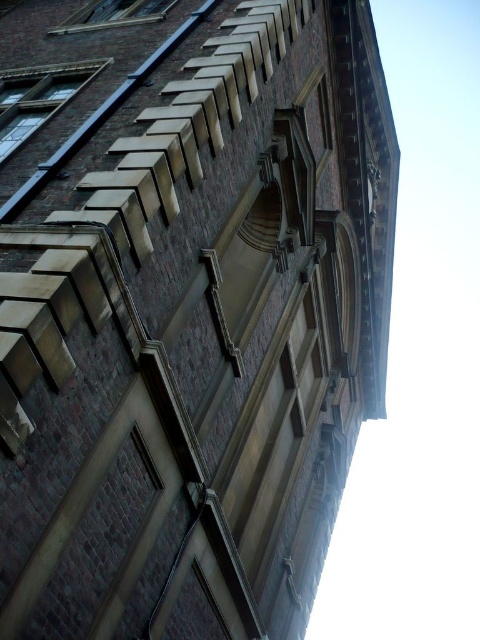
Question: Which point appears closest to the camera in this image?

Choices:
 (A) (x=13, y=83)
 (B) (x=115, y=20)

Answer: (A)

Question: Which point appears farthest from the camera in this image?

Choices:
 (A) click(x=59, y=65)
 (B) click(x=68, y=22)

Answer: (B)

Question: Can you confirm if matte brick window at upper left is wider than clear glass window at upper left?

Choices:
 (A) no
 (B) yes

Answer: (A)

Question: Does matte brick window at upper left come behind clear glass window at upper left?

Choices:
 (A) no
 (B) yes

Answer: (A)

Question: Can you confirm if matte brick window at upper left is positioned above clear glass window at upper left?

Choices:
 (A) no
 (B) yes

Answer: (A)